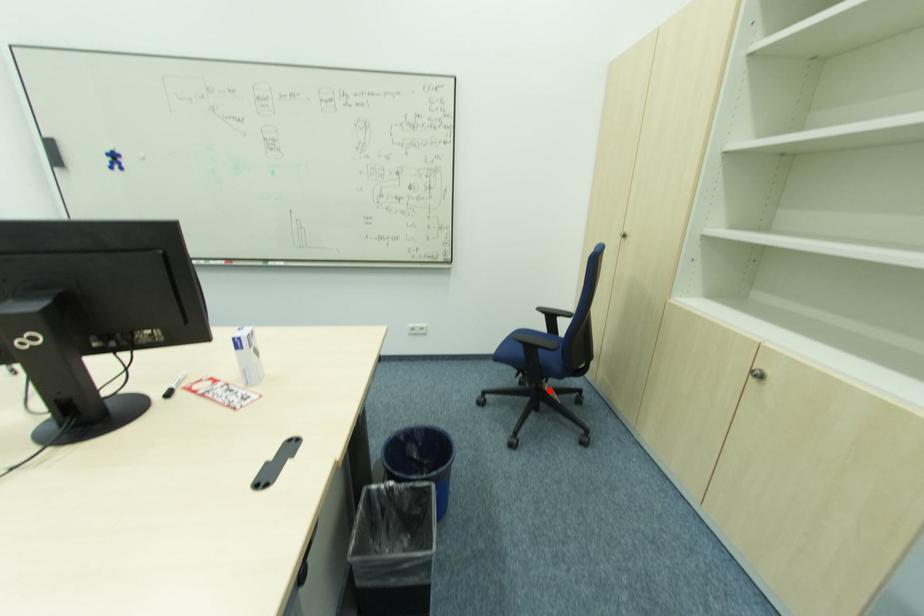
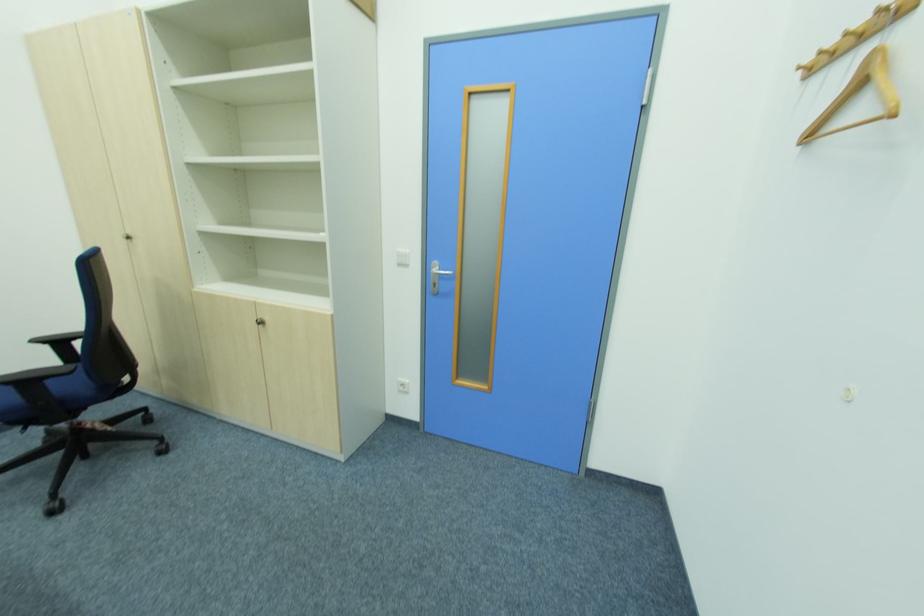
Find the pixel in the second image that matches the highlighted location in the first image.

(91, 429)